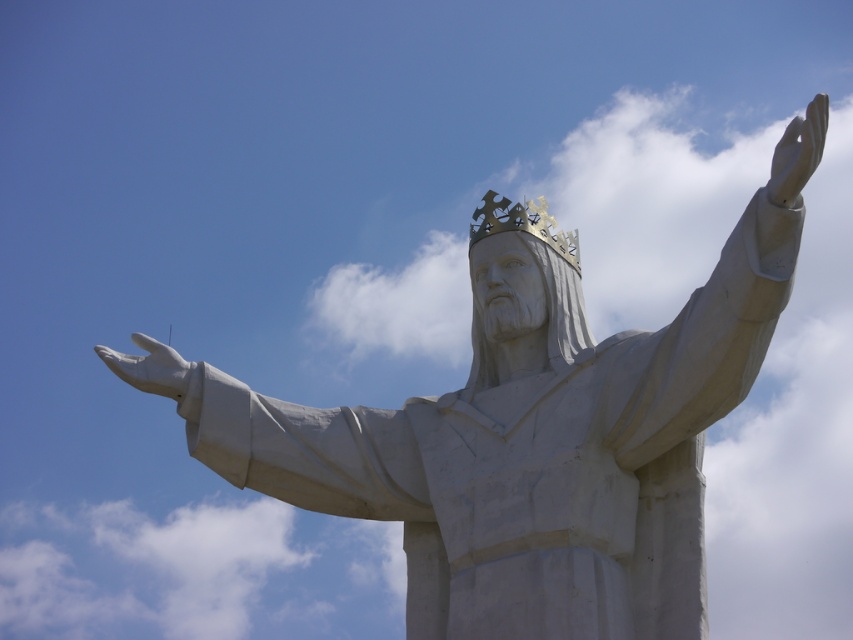
You are an art conservator assessing the statue for preservation. You notice two elements of the statue that require immediate attention. The gold metallic crown at center and the white matte hand at lower left. Which of these two elements has a smaller cross section?

The gold metallic crown at center has a smaller cross section than the white matte hand at lower left.

You are an art restorer examining the statue. You need to place a protective covering over both the white matte hand at upper right and the white matte hand at lower left. Which hand requires a larger covering based on their widths?

The white matte hand at upper right requires a larger covering because its width is greater than the white matte hand at lower left.

Based on the photo, you are a painter standing 10 meters away from the statue. You want to paint the gold metallic crown at center and the white matte hand at lower left. Can you reach both objects with your paintbrush if your arm can extend 1.5 meters?

The distance between the gold metallic crown at center and the white matte hand at lower left is 15.49 meters. Since you are 10 meters away from the statue, your arm can only extend 1.5 meters, so you cannot reach either object to paint them.